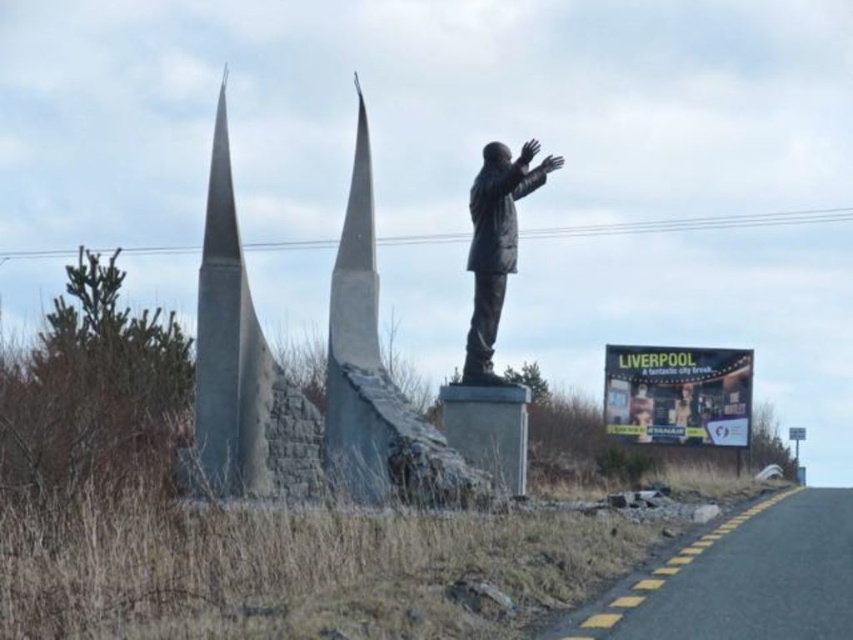
Question: Does yellow billboard at right appear over bronze statue at center?

Choices:
 (A) no
 (B) yes

Answer: (A)

Question: Which object is farther from the camera taking this photo?

Choices:
 (A) yellow billboard at right
 (B) bronze statue at center

Answer: (A)

Question: Among these points, which one is farthest from the camera?

Choices:
 (A) (509, 244)
 (B) (730, 362)

Answer: (B)

Question: Can you confirm if yellow billboard at right is bigger than bronze statue at center?

Choices:
 (A) yes
 (B) no

Answer: (A)

Question: Which point is closer to the camera?

Choices:
 (A) yellow billboard at right
 (B) bronze statue at center

Answer: (B)

Question: Is yellow billboard at right to the right of bronze statue at center from the viewer's perspective?

Choices:
 (A) no
 (B) yes

Answer: (B)